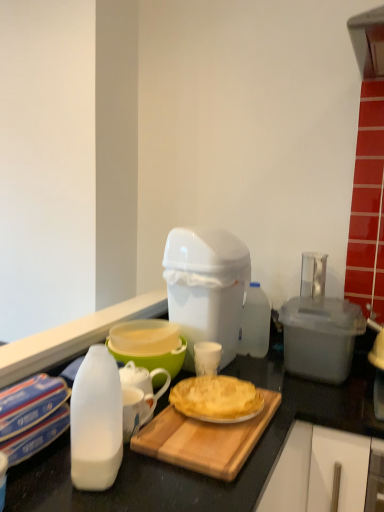
Question: Is white plastic trash can at center, marked as the second appliance in a right-to-left arrangement, outside transparent plastic container at right, the first appliance positioned from the right?

Choices:
 (A) no
 (B) yes

Answer: (B)

Question: Does white plastic trash can at center, marked as the second appliance in a right-to-left arrangement, have a greater height compared to transparent plastic container at right, placed as the 2th appliance when sorted from left to right?

Choices:
 (A) no
 (B) yes

Answer: (B)

Question: Is white plastic trash can at center, the first appliance when ordered from left to right, to the right of transparent plastic container at right, the first appliance positioned from the right, from the viewer's perspective?

Choices:
 (A) yes
 (B) no

Answer: (B)

Question: Is white plastic trash can at center, marked as the second appliance in a right-to-left arrangement, wider than transparent plastic container at right, placed as the 2th appliance when sorted from left to right?

Choices:
 (A) yes
 (B) no

Answer: (A)

Question: From the image's perspective, is white plastic trash can at center, marked as the second appliance in a right-to-left arrangement, above transparent plastic container at right, placed as the 2th appliance when sorted from left to right?

Choices:
 (A) yes
 (B) no

Answer: (A)

Question: Is point (296, 312) closer or farther from the camera than point (185, 234)?

Choices:
 (A) closer
 (B) farther

Answer: (B)

Question: In terms of height, does transparent plastic container at right, placed as the 2th appliance when sorted from left to right, look taller or shorter compared to white plastic trash can at center, marked as the second appliance in a right-to-left arrangement?

Choices:
 (A) short
 (B) tall

Answer: (A)

Question: From the image's perspective, is transparent plastic container at right, the first appliance positioned from the right, located above or below white plastic trash can at center, the first appliance when ordered from left to right?

Choices:
 (A) below
 (B) above

Answer: (A)

Question: Is transparent plastic container at right, the first appliance positioned from the right, spatially inside white plastic trash can at center, the first appliance when ordered from left to right, or outside of it?

Choices:
 (A) inside
 (B) outside

Answer: (B)

Question: Considering the relative positions of white plastic trash can at center, the first appliance when ordered from left to right, and wooden cutting board at center in the image provided, is white plastic trash can at center, the first appliance when ordered from left to right, to the left or to the right of wooden cutting board at center?

Choices:
 (A) right
 (B) left

Answer: (B)

Question: Is white plastic trash can at center, marked as the second appliance in a right-to-left arrangement, wider or thinner than wooden cutting board at center?

Choices:
 (A) thin
 (B) wide

Answer: (B)

Question: Relative to wooden cutting board at center, is white plastic trash can at center, marked as the second appliance in a right-to-left arrangement, in front or behind?

Choices:
 (A) behind
 (B) front

Answer: (A)

Question: Considering the positions of white plastic trash can at center, the first appliance when ordered from left to right, and wooden cutting board at center in the image, is white plastic trash can at center, the first appliance when ordered from left to right, taller or shorter than wooden cutting board at center?

Choices:
 (A) tall
 (B) short

Answer: (A)

Question: Relative to green plastic bowl at center, is transparent plastic container at right, placed as the 2th appliance when sorted from left to right, in front or behind?

Choices:
 (A) front
 (B) behind

Answer: (B)

Question: Based on their positions, is transparent plastic container at right, placed as the 2th appliance when sorted from left to right, located to the left or right of green plastic bowl at center?

Choices:
 (A) right
 (B) left

Answer: (A)